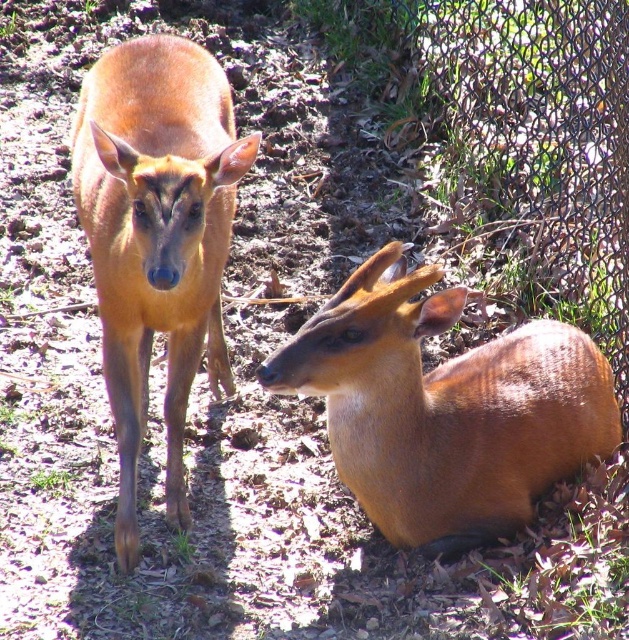
Question: Which object is farther from the camera taking this photo?

Choices:
 (A) brown matte antelope at left
 (B) brown matte antelope at lower right

Answer: (B)

Question: Can you confirm if brown matte antelope at lower right is positioned above brown matte antelope at left?

Choices:
 (A) yes
 (B) no

Answer: (B)

Question: Does brown matte antelope at lower right appear on the right side of brown matte antelope at left?

Choices:
 (A) yes
 (B) no

Answer: (A)

Question: Is the position of brown matte antelope at lower right more distant than that of brown matte antelope at left?

Choices:
 (A) no
 (B) yes

Answer: (B)

Question: Which object is closer to the camera taking this photo?

Choices:
 (A) brown matte antelope at left
 (B) brown matte antelope at lower right

Answer: (A)